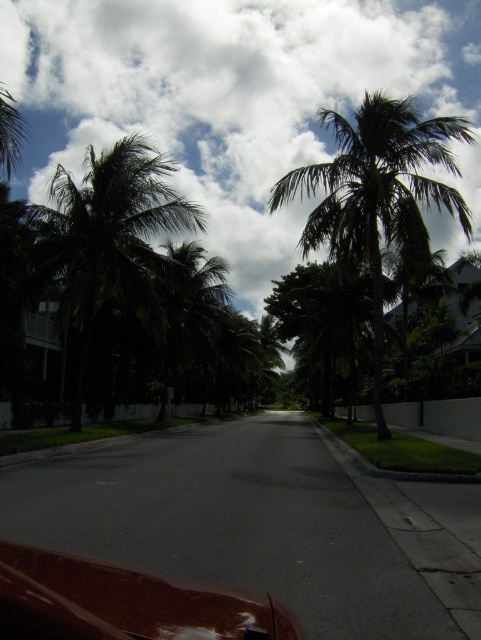
You are standing on the sidewalk next to the white wall and want to take a photo of the white fluffy cloud at upper center and the green leafy palm tree at center. Which object should you focus on first if you want to capture both in the same frame without moving the camera?

The white fluffy cloud at upper center is smaller in size compared to the green leafy palm tree at center, so you should focus on the green leafy palm tree at center first to ensure it fills the frame appropriately before adjusting for the smaller cloud.

You are a bird flying over the quiet street. You want to land on the highest object between the white fluffy cloud at upper center and the green leafy palm tree at center. Which one should you choose?

The white fluffy cloud at upper center is taller than the green leafy palm tree at center, so you should choose the white fluffy cloud at upper center to land on as it is the higher object.

Looking at this image, you are standing on the sidewalk next to the white wall and looking down the street. Which object, the white fluffy cloud at upper center or the green leafy palm tree at center, would appear closer to you?

The green leafy palm tree at center is behind the white fluffy cloud at upper center, so the white fluffy cloud at upper center would appear closer to you.